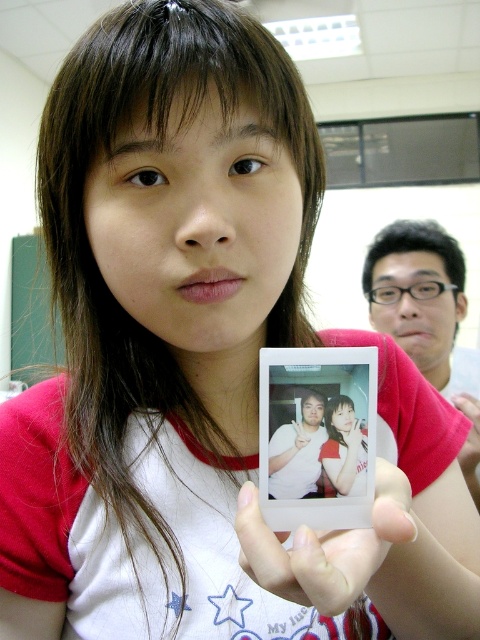
Question: Among these points, which one is nearest to the camera?

Choices:
 (A) (347, 355)
 (B) (326, 472)
 (C) (340, 556)
 (D) (451, 339)

Answer: (C)

Question: Can you confirm if white glossy photo frame at center is positioned above white matte polaroid at center?

Choices:
 (A) yes
 (B) no

Answer: (A)

Question: Which object appears closest to the camera in this image?

Choices:
 (A) matte white photo at center
 (B) white glossy photo frame at center
 (C) matte white instant photo at center
 (D) white matte polaroid at center

Answer: (D)

Question: From the image, what is the correct spatial relationship of white matte polaroid at center in relation to matte white instant photo at center?

Choices:
 (A) left
 (B) right

Answer: (A)

Question: Can you confirm if white glossy photo frame at center is positioned to the left of white matte polaroid at center?

Choices:
 (A) yes
 (B) no

Answer: (A)

Question: Estimate the real-world distances between objects in this image. Which object is farther from the white matte polaroid at center?

Choices:
 (A) matte white instant photo at center
 (B) white glossy photo frame at center
 (C) matte white photo at center

Answer: (A)